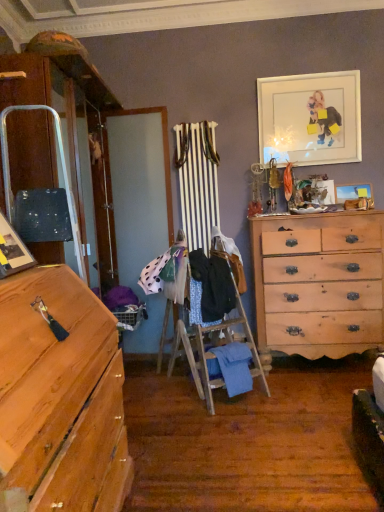
Identify the location of blank space situated above white matte picture frame at upper right, positioned as the third picture frame in bottom-to-top order (from a real-world perspective). (314, 72).